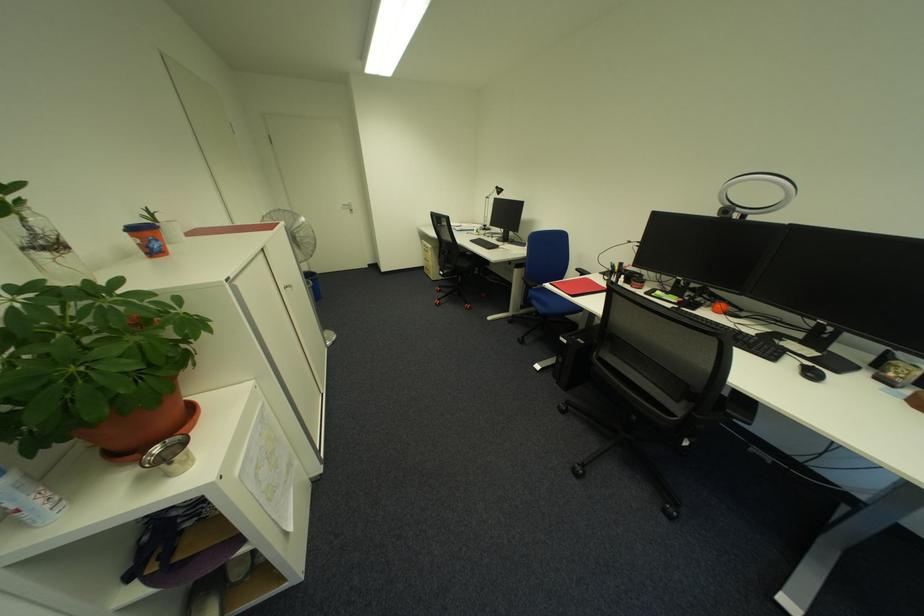
The height and width of the screenshot is (616, 924). Identify the location of silver cabinet handle. (286, 286).